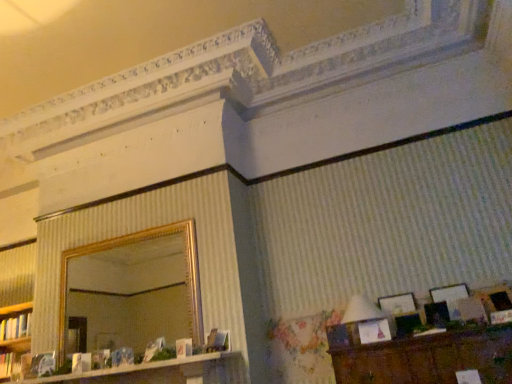
The width and height of the screenshot is (512, 384). I want to click on free point above gold-framed mirror at upper center (from a real-world perspective), so click(x=126, y=228).